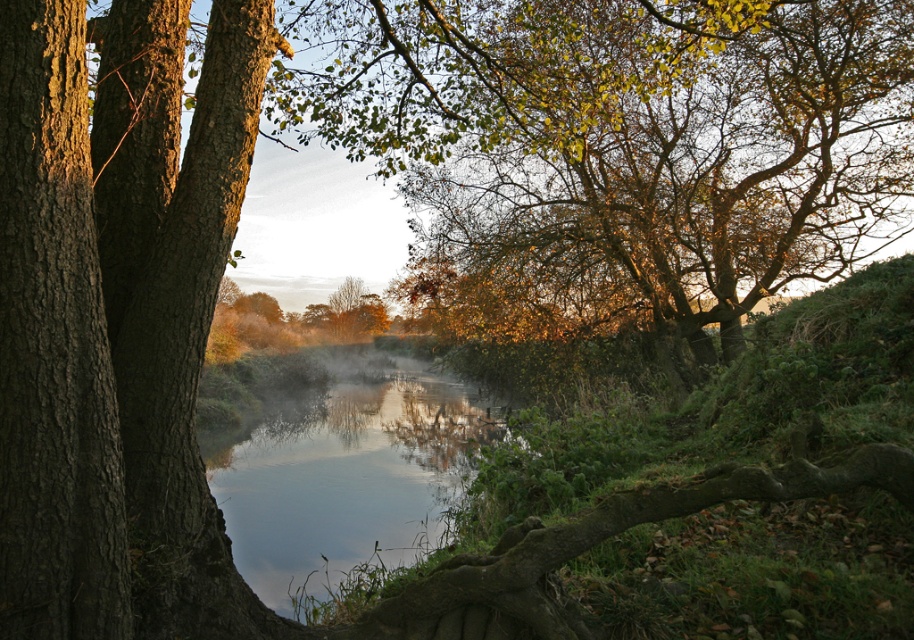
Does point (585, 109) come closer to viewer compared to point (270, 483)?

That is True.

Who is more distant from viewer, (815,150) or (392,369)?

The point (392,369) is more distant.

Based on the photo, measure the distance between point (x=688, y=385) and camera.

A: The distance of point (x=688, y=385) from camera is 18.03 meters.

At what (x,y) coordinates should I click in order to perform the action: click on golden-brown textured tree at upper right. Please return your answer as a coordinate pair (x, y). Looking at the image, I should click on (670, 168).